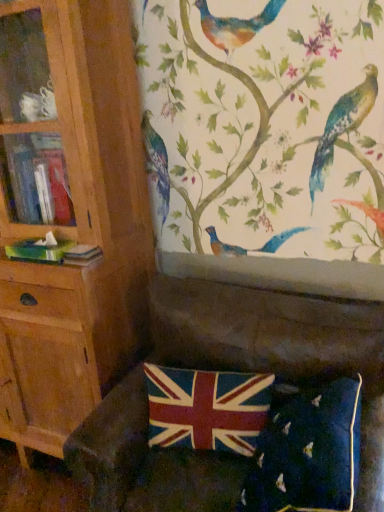
Question: Visually, is velvet union jack pillow at lower center positioned to the left or to the right of velvet dark green couch at lower center?

Choices:
 (A) left
 (B) right

Answer: (B)

Question: From a real-world perspective, is velvet union jack pillow at lower center above or below velvet dark green couch at lower center?

Choices:
 (A) above
 (B) below

Answer: (A)

Question: Considering the real-world distances, which object is closest to the velvet union jack pillow at lower center?

Choices:
 (A) wooden bookcase at left
 (B) velvet union jack at lower center
 (C) velvet dark green couch at lower center

Answer: (C)

Question: Which object is positioned farthest from the velvet union jack pillow at lower center?

Choices:
 (A) wooden bookcase at left
 (B) velvet union jack at lower center
 (C) velvet dark green couch at lower center

Answer: (A)